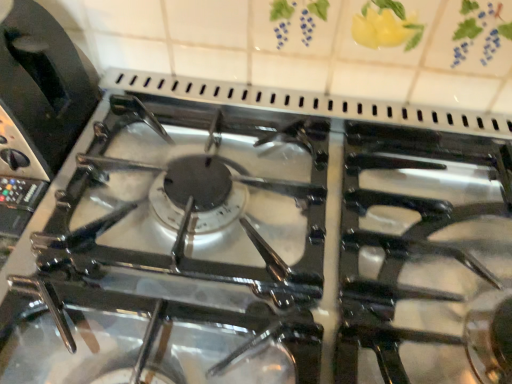
Measure the distance between black matte toaster at left and camera.

black matte toaster at left and camera are 18.06 inches apart from each other.

This screenshot has height=384, width=512. What do you see at coordinates (40, 91) in the screenshot?
I see `black matte toaster at left` at bounding box center [40, 91].

Identify the location of black matte toaster at left. (40, 91).

Locate an element on the screen. This screenshot has width=512, height=384. black matte toaster at left is located at coordinates (40, 91).